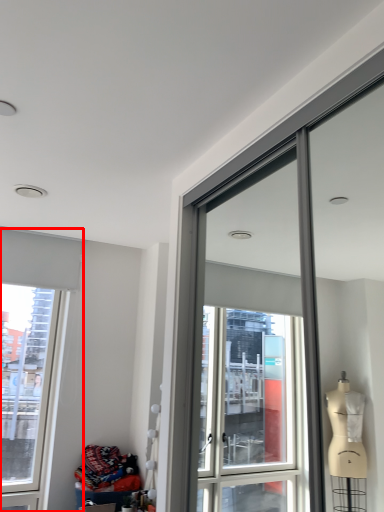
Question: Where is window (annotated by the red box) located in relation to material in the image?

Choices:
 (A) right
 (B) left

Answer: (B)